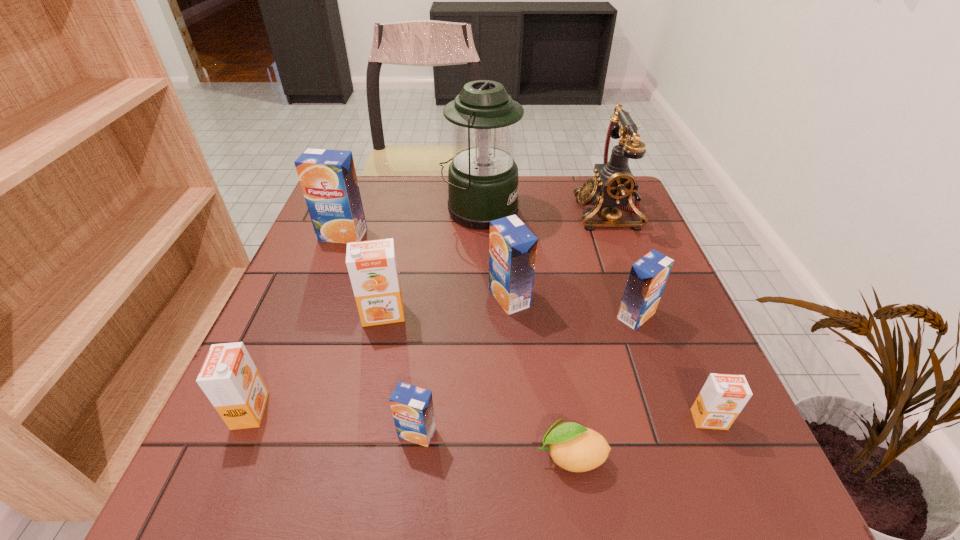
You are a GUI agent. You are given a task and a screenshot of the screen. Output one action in this format:
    pyautogui.click(x=<x>, y=<y>)
    Task: Click on the vacant area situated 0.230m on the front of the telephone, featuring the rotary dial
    This screenshot has height=540, width=960.
    Given the screenshot: What is the action you would take?
    coord(491,212)

Where is `free space located on the front of the farthest blue orange_juice`? The height and width of the screenshot is (540, 960). free space located on the front of the farthest blue orange_juice is located at coordinates (326, 277).

Locate an element on the screen. The image size is (960, 540). vacant region located 0.060m on the right of the third blue orange_juice from left to right is located at coordinates (558, 298).

This screenshot has height=540, width=960. What are the coordinates of `vacant region located on the back of the biggest orange orange juice` in the screenshot? It's located at (401, 234).

The width and height of the screenshot is (960, 540). I want to click on free region located 0.170m on the left of the rightmost blue orange_juice, so click(534, 316).

Where is `vacant space located on the front of the second smallest orange orange juice`? Image resolution: width=960 pixels, height=540 pixels. vacant space located on the front of the second smallest orange orange juice is located at coordinates (228, 460).

Identify the location of vacant space located on the left of the nearest blue orange_juice. The height and width of the screenshot is (540, 960). (362, 433).

Where is `vacant region located on the left of the rightmost orange orange juice`? vacant region located on the left of the rightmost orange orange juice is located at coordinates (603, 420).

Where is `free space located 0.080m with leaves positioned above the lemon`? The height and width of the screenshot is (540, 960). free space located 0.080m with leaves positioned above the lemon is located at coordinates (485, 456).

Identify the location of free point located 0.060m with leaves positioned above the lemon. The width and height of the screenshot is (960, 540). (497, 456).